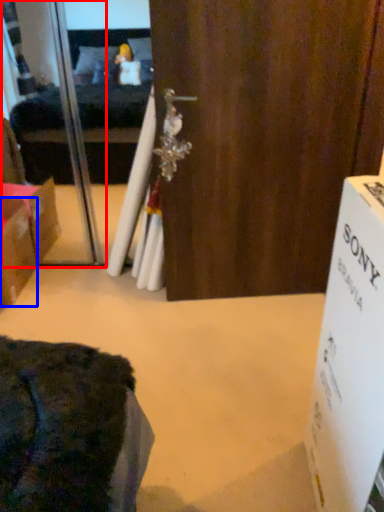
Question: Which object is closer to the camera taking this photo, screen door (highlighted by a red box) or box (highlighted by a blue box)?

Choices:
 (A) screen door
 (B) box

Answer: (B)